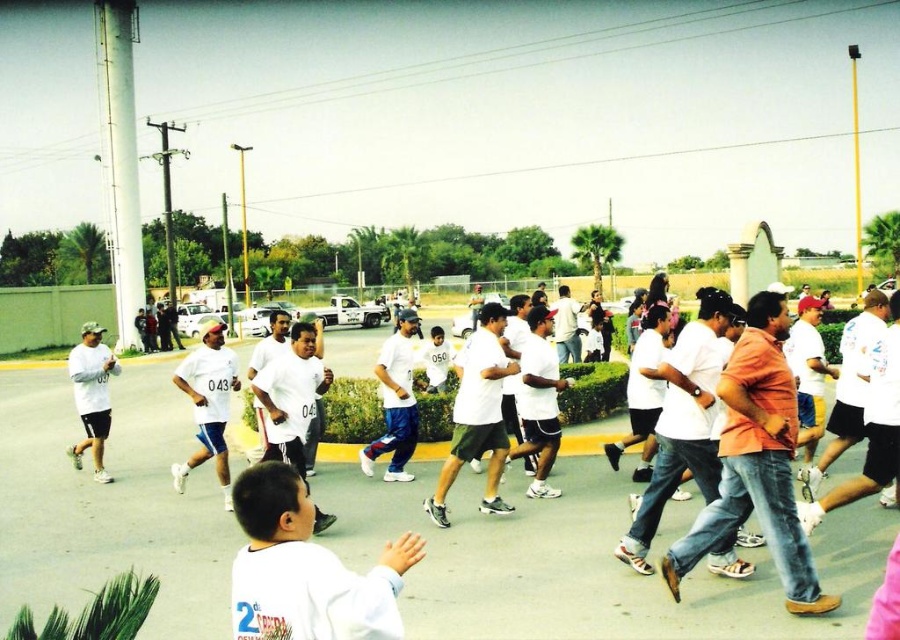
Question: Is white matte shirt at lower left to the right of white matte shirt at left from the viewer's perspective?

Choices:
 (A) no
 (B) yes

Answer: (B)

Question: Is white matte shirt at lower left below white matte shirt at left?

Choices:
 (A) yes
 (B) no

Answer: (B)

Question: Which point is farther to the camera?

Choices:
 (A) white matte shirt at left
 (B) white matte shirt at lower left

Answer: (A)

Question: Is white matte shirt at lower left to the left of white matte shirt at left from the viewer's perspective?

Choices:
 (A) no
 (B) yes

Answer: (A)

Question: Which point is farther from the camera taking this photo?

Choices:
 (A) (258, 636)
 (B) (76, 368)

Answer: (B)